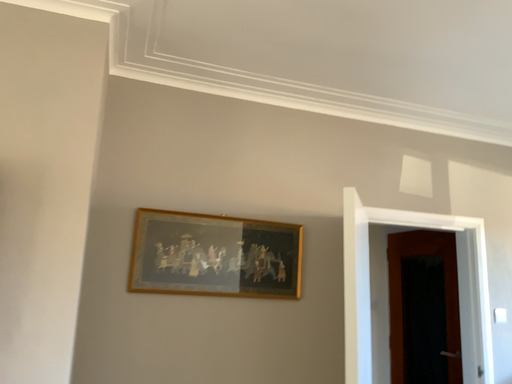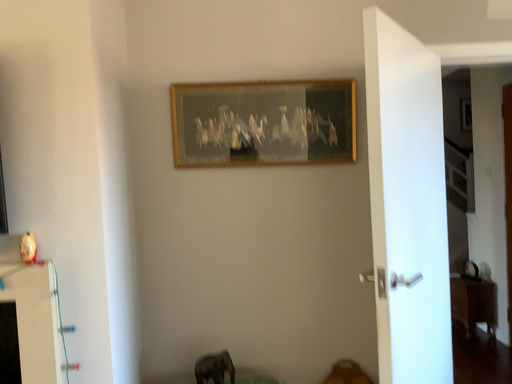
Question: How did the camera likely rotate when shooting the video?

Choices:
 (A) rotated downward
 (B) rotated upward

Answer: (A)